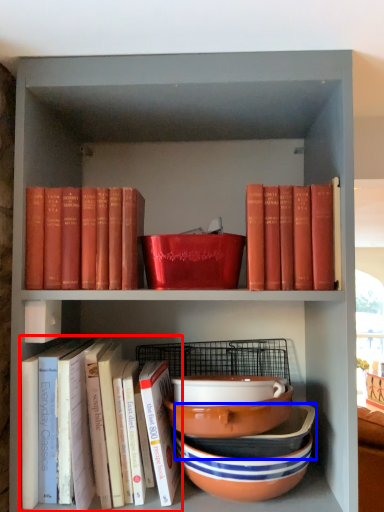
Question: Which object appears closest to the camera in this image, book (highlighted by a red box) or bowl (highlighted by a blue box)?

Choices:
 (A) book
 (B) bowl

Answer: (A)